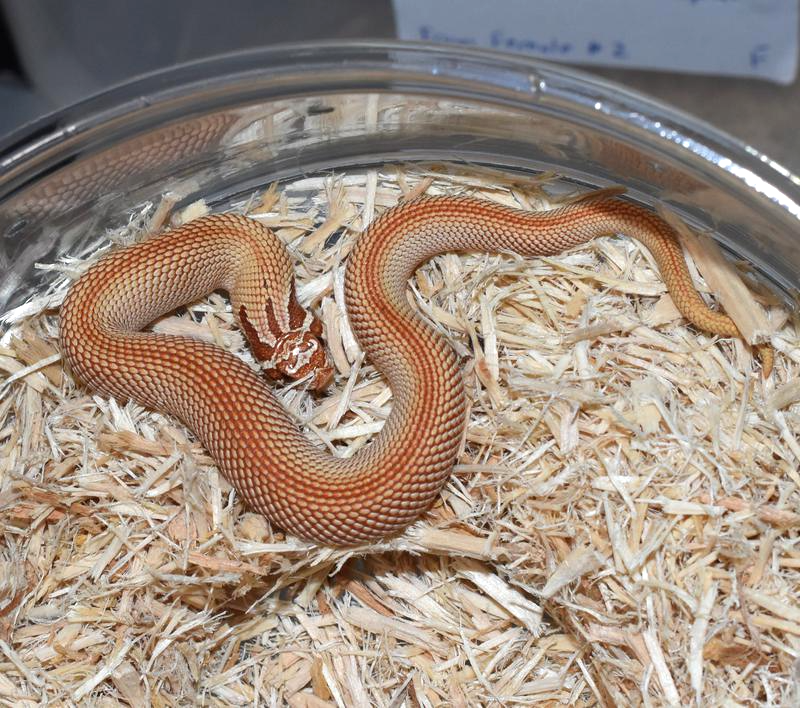
The width and height of the screenshot is (800, 708). What are the coordinates of `tray` in the screenshot? It's located at (509, 110).